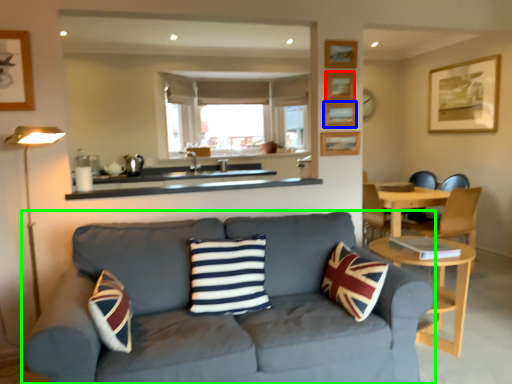
Question: Based on their relative distances, which object is nearer to picture frame (highlighted by a red box)? Choose from picture frame (highlighted by a blue box) and studio couch (highlighted by a green box).

Choices:
 (A) picture frame
 (B) studio couch

Answer: (A)